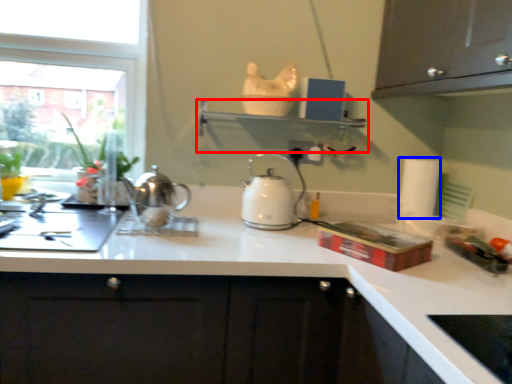
Question: Among these objects, which one is farthest to the camera, shelf (highlighted by a red box) or paper towel (highlighted by a blue box)?

Choices:
 (A) shelf
 (B) paper towel

Answer: (B)